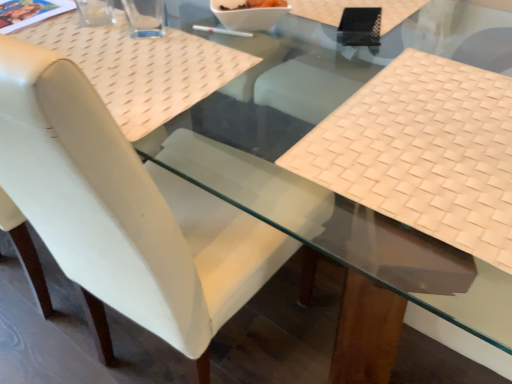
This screenshot has height=384, width=512. What are the coordinates of `free space in front of transparent glass at upper left, the 2th clear when ordered from left to right` in the screenshot? It's located at (138, 64).